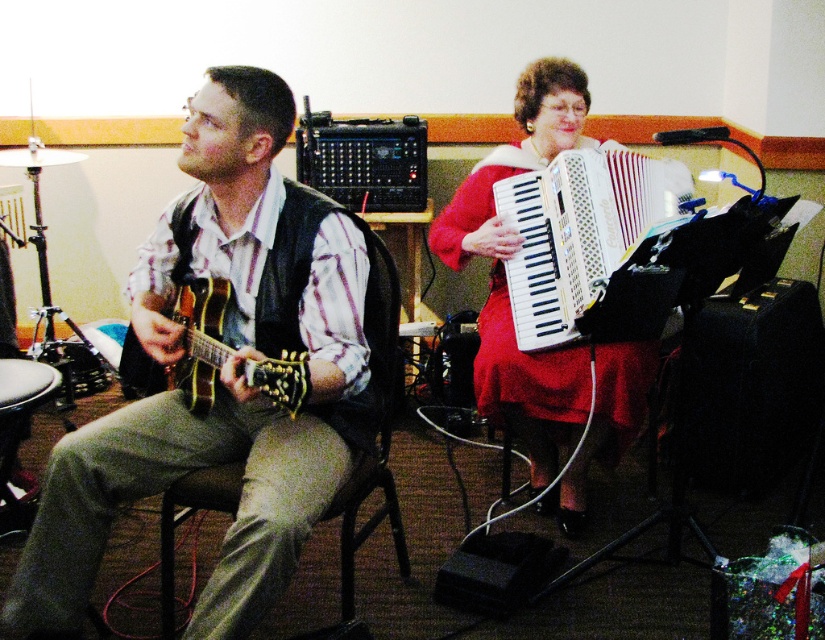
Is red satin dress at center wider than white plastic accordion at center?

Yes, red satin dress at center is wider than white plastic accordion at center.

The height and width of the screenshot is (640, 825). Find the location of `red satin dress at center`. red satin dress at center is located at coordinates (505, 280).

Is point (453, 218) positioned in front of point (573, 236)?

No, it is behind (573, 236).

Identify the location of red satin dress at center. Image resolution: width=825 pixels, height=640 pixels. (505, 280).

Is white plastic accordion at center taller than matte wood guitar at left?

Yes, white plastic accordion at center is taller than matte wood guitar at left.

Can you confirm if white plastic accordion at center is positioned to the left of matte wood guitar at left?

In fact, white plastic accordion at center is to the right of matte wood guitar at left.

Does point (648, 161) lie in front of point (210, 360)?

No, it is not.

The image size is (825, 640). Identify the location of white plastic accordion at center. (578, 230).

Which of these two, matte black guitar at left or brown wooden chair at left, stands taller?

Standing taller between the two is matte black guitar at left.

Does matte black guitar at left lie in front of brown wooden chair at left?

Yes, matte black guitar at left is closer to the viewer.

Does point (149, 401) lie behind point (166, 584)?

Yes, point (149, 401) is farther from viewer.

This screenshot has height=640, width=825. Identify the location of matte black guitar at left. (224, 381).